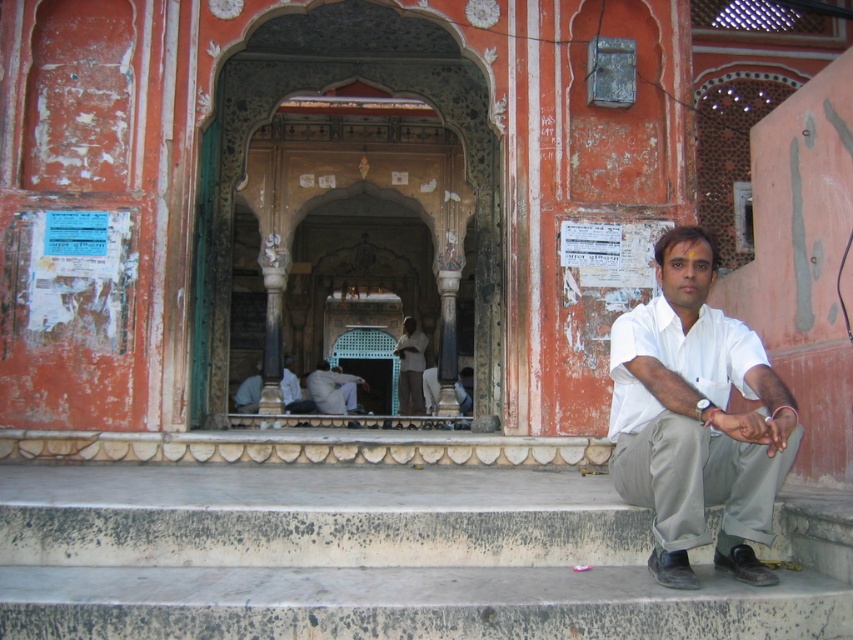
You are standing in front of the traditional building and see the light brown fabric pants at center and the light gray fabric at center. Which one is closer to you?

The light brown fabric pants at center is closer to you because it is further to the viewer than the light gray fabric at center.

From the picture: You are standing at the entrance of the traditional building and want to sit down. The light brown wooden bench at center and the light gray fabric at center are both available. Which one is closer to you?

The light brown wooden bench at center is closer to you because it is in front of the light gray fabric at center.

You are a tailor observing the light brown fabric pants at center and the light gray fabric at center in the scene. Which fabric has a smaller size?

The light brown fabric pants at center has a smaller size compared to the light gray fabric at center.